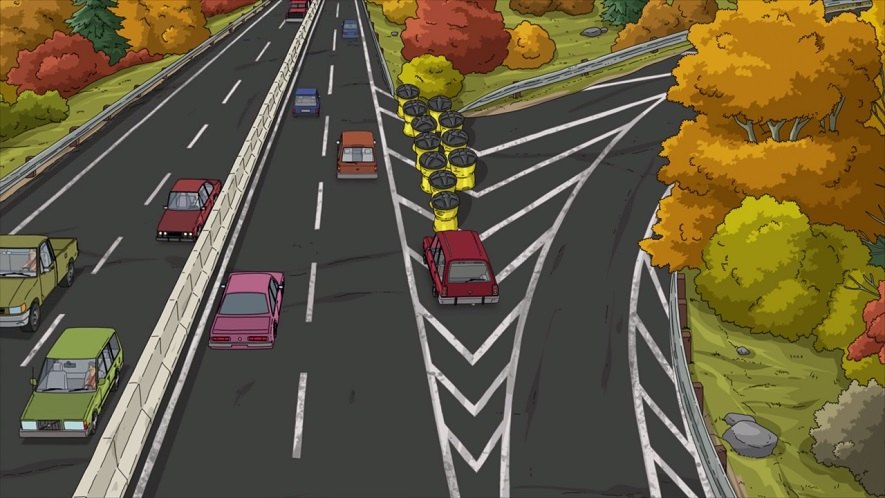
Locate an element on the screen. The image size is (885, 498). dividing barrier is located at coordinates (196, 259).